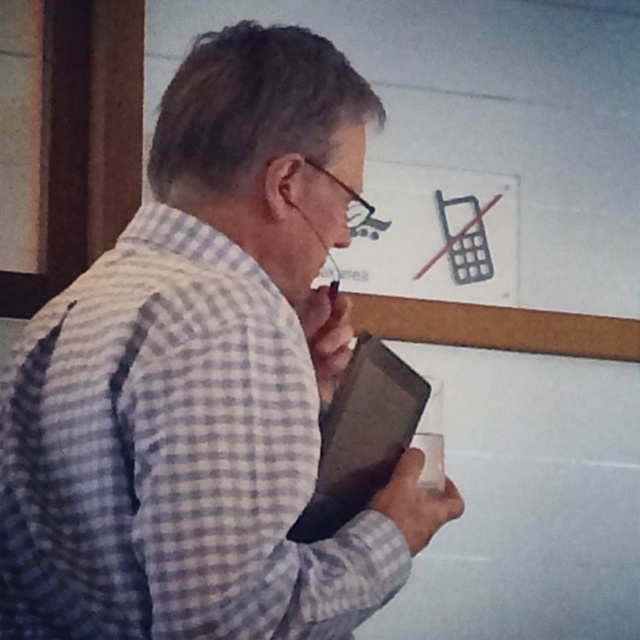
You are a photographer standing at a distance of 3 feet from the checkered fabric shirt at center. You want to take a clear photo of the shirt. Is the current distance sufficient to capture the shirt in focus?

The checkered fabric shirt at center is 33.10 inches away from the camera. Since 33.10 inches is approximately 2.76 feet, which is less than 3 feet, the photographer is close enough to capture the shirt in focus.

Based on the photo, you are an interior designer assessing the layout of this room. The checkered fabric shirt at center and the white matte bulletin board at upper center are both in view. Which object occupies a larger horizontal space in the image?

The white matte bulletin board at upper center occupies a larger horizontal space because its width is greater than the checkered fabric shirt at center.

The checkered fabric shirt at center is represented by point (205, 380). What is the coordinate of the checkered fabric shirt at center?

The checkered fabric shirt at center is represented by point (205, 380).